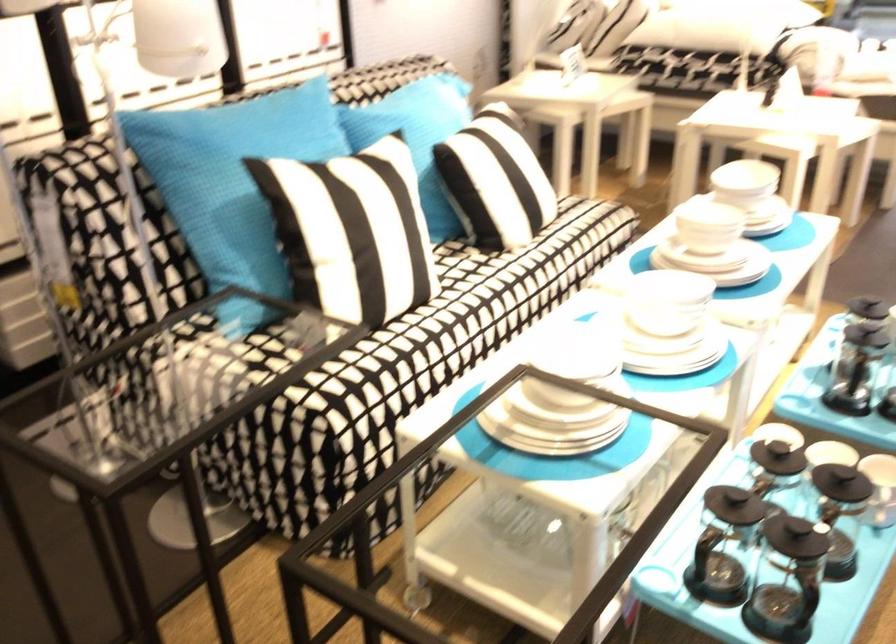
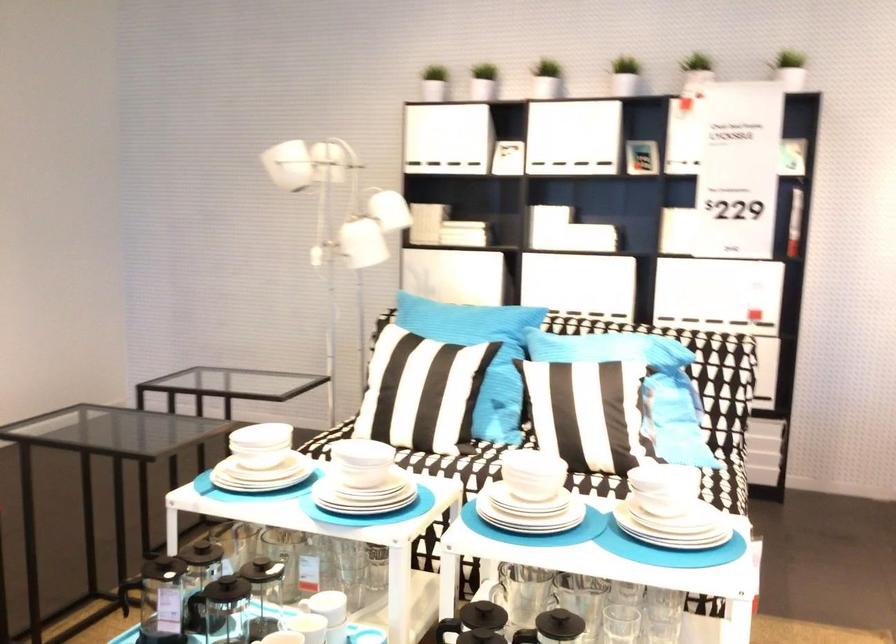
Find the pixel in the second image that matches point (694, 301) in the first image.

(360, 464)